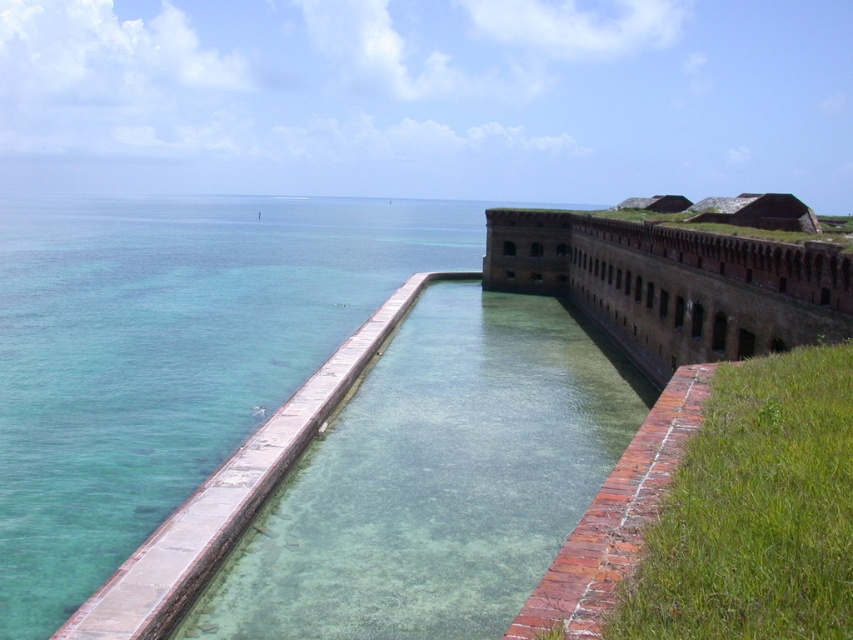
You are a maintenance worker assigned to inspect the clear concrete pool at center and the brown brick wall at center. From your vantage point, which object is positioned lower in the scene?

The clear concrete pool at center is positioned below the brown brick wall at center, so it is lower in the scene.